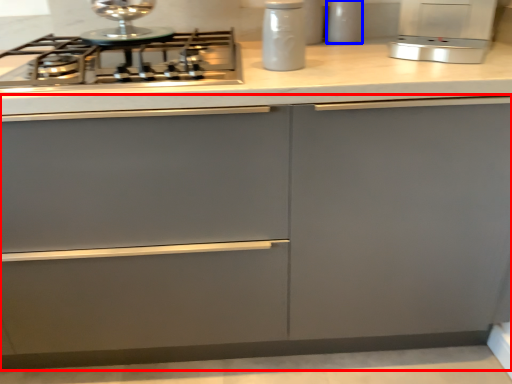
Question: Among these objects, which one is nearest to the camera, cabinetry (highlighted by a red box) or kitchen appliance (highlighted by a blue box)?

Choices:
 (A) cabinetry
 (B) kitchen appliance

Answer: (A)